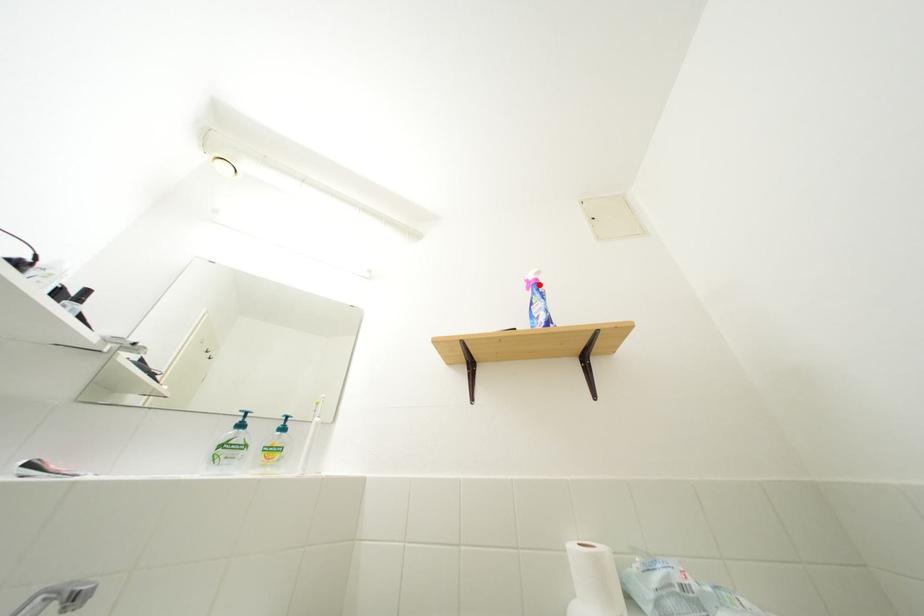
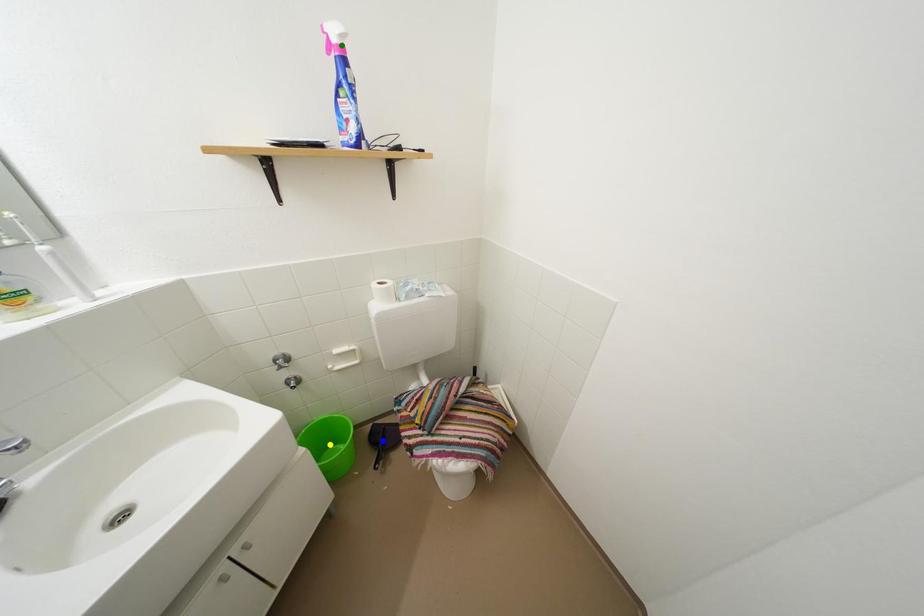
Question: I am providing you with two images of the same scene from different viewpoints. A red point is marked on the first image. You are given multiple points on the second image. Which spot in image 2 lines up with the point in image 1?

Choices:
 (A) blue point
 (B) yellow point
 (C) green point

Answer: (C)